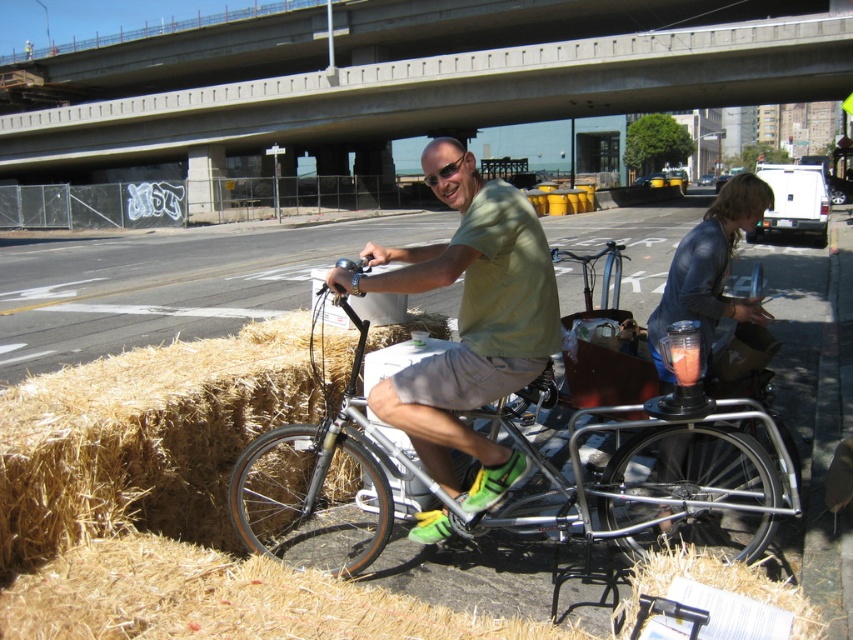
Question: Can you confirm if concrete at upper center is positioned to the right of green matte shirt at center?

Choices:
 (A) no
 (B) yes

Answer: (A)

Question: Which of the following is the closest to the observer?

Choices:
 (A) click(442, 260)
 (B) click(674, 340)

Answer: (A)

Question: Which of the following is the farthest from the observer?

Choices:
 (A) (289, 131)
 (B) (409, 422)

Answer: (A)

Question: Which of the following is the farthest from the observer?

Choices:
 (A) brown hay bales at lower left
 (B) silver metallic bicycle at center
 (C) green matte shirt at center

Answer: (A)

Question: Can you confirm if silver metallic bicycle at center is wider than brown hay bales at lower left?

Choices:
 (A) yes
 (B) no

Answer: (B)

Question: Observing the image, what is the correct spatial positioning of green matte shirt at center in reference to translucent plastic cup at center?

Choices:
 (A) above
 (B) below

Answer: (B)